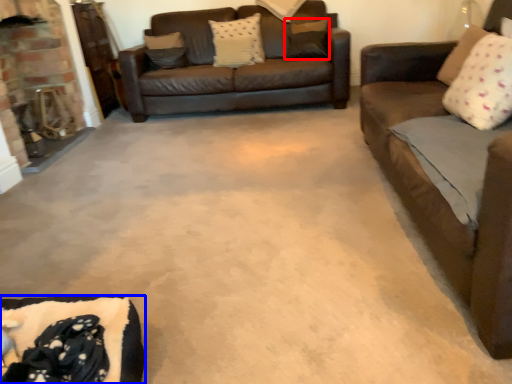
Question: Among these objects, which one is nearest to the camera, pillow (highlighted by a red box) or couch (highlighted by a blue box)?

Choices:
 (A) pillow
 (B) couch

Answer: (B)